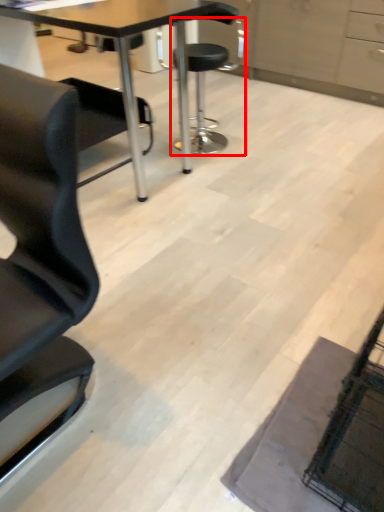
Question: Observing the image, what is the correct spatial positioning of chair (annotated by the red box) in reference to table?

Choices:
 (A) right
 (B) left

Answer: (A)